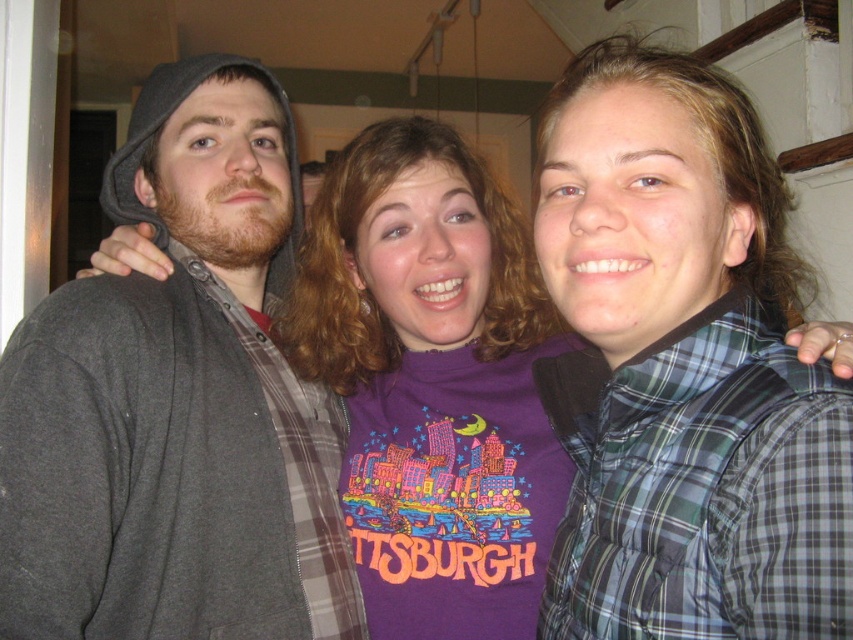
Does green plaid vest at right lie behind dark gray hoodie at left?

No.

Is green plaid vest at right to the right of dark gray hoodie at left from the viewer's perspective?

Yes, green plaid vest at right is to the right of dark gray hoodie at left.

Is point (664, 268) closer to viewer compared to point (280, 188)?

Yes.

I want to click on green plaid vest at right, so click(x=683, y=369).

Consider the image. Is dark gray hoodie at left shorter than purple cotton t-shirt at center?

No, dark gray hoodie at left is not shorter than purple cotton t-shirt at center.

Between dark gray hoodie at left and purple cotton t-shirt at center, which one has less height?

Standing shorter between the two is purple cotton t-shirt at center.

Identify the location of dark gray hoodie at left. The height and width of the screenshot is (640, 853). (177, 403).

The image size is (853, 640). In order to click on dark gray hoodie at left in this screenshot , I will do `click(177, 403)`.

Between green plaid vest at right and purple cotton t-shirt at center, which one is positioned lower?

purple cotton t-shirt at center is lower down.

Which is behind, point (579, 214) or point (561, 611)?

Positioned behind is point (561, 611).

Locate an element on the screen. green plaid vest at right is located at coordinates (683, 369).